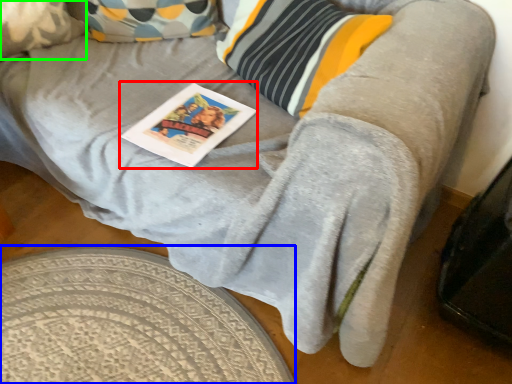
Question: Based on their relative distances, which object is farther from magazine (highlighted by a red box)? Choose from round table (highlighted by a blue box) and pillow (highlighted by a green box).

Choices:
 (A) round table
 (B) pillow

Answer: (B)